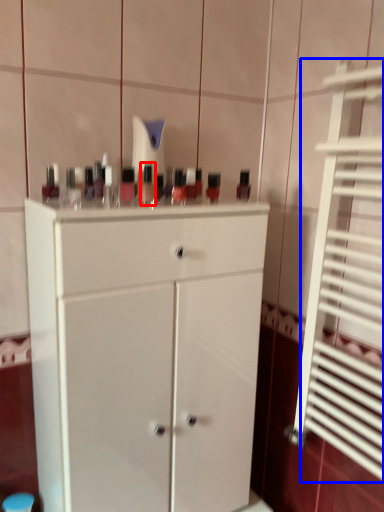
Question: Among these objects, which one is farthest to the camera, mouthwash (highlighted by a red box) or shutter (highlighted by a blue box)?

Choices:
 (A) mouthwash
 (B) shutter

Answer: (A)